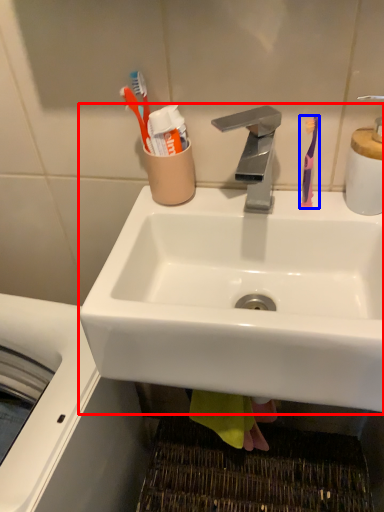
Question: Which object is closer to the camera taking this photo, sink (highlighted by a red box) or toothbrush (highlighted by a blue box)?

Choices:
 (A) sink
 (B) toothbrush

Answer: (A)